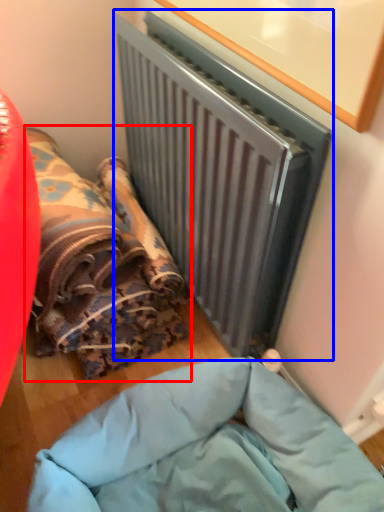
Question: Among these objects, which one is farthest to the camera, bean bag chair (highlighted by a red box) or radiator (highlighted by a blue box)?

Choices:
 (A) bean bag chair
 (B) radiator

Answer: (A)